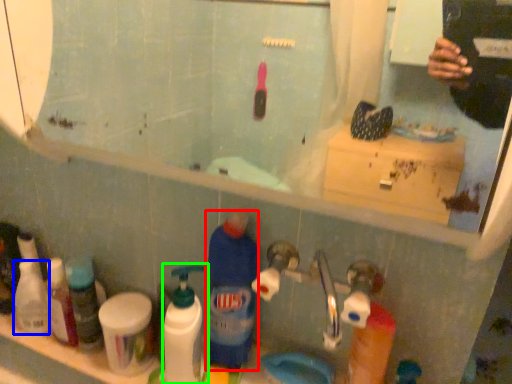
Question: Considering the real-world distances, which object is closest to cleaning product (highlighted by a red box)? toiletry (highlighted by a blue box) or cleaning product (highlighted by a green box).

Choices:
 (A) toiletry
 (B) cleaning product

Answer: (B)